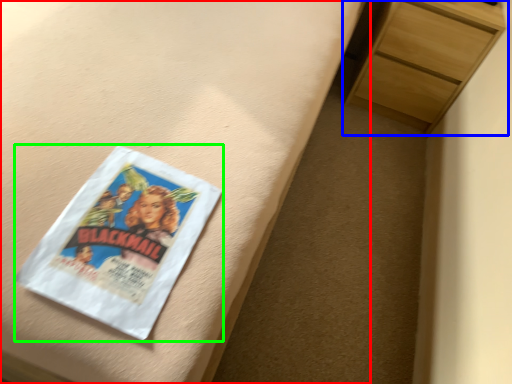
Question: Which object is positioned closest to bed frame (highlighted by a red box)? Select from chest of drawers (highlighted by a blue box) and paperback book (highlighted by a green box).

Choices:
 (A) chest of drawers
 (B) paperback book

Answer: (B)